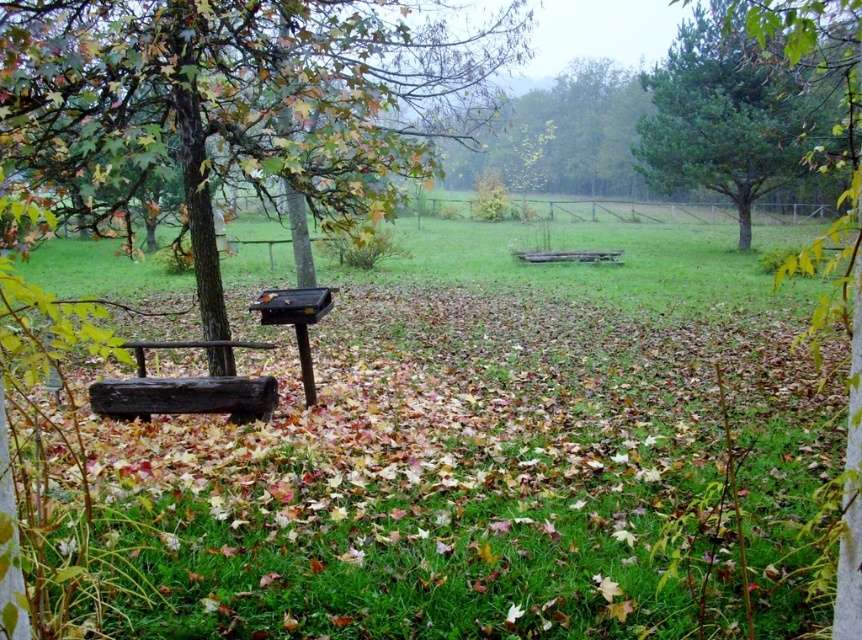
You are planning to take a photo of the brown textured tree trunk at left and the green pine tree at upper right. Which one should you focus on first if you want to capture both in the same frame without moving the camera?

The brown textured tree trunk at left is much taller than the green pine tree at upper right, so you should focus on the brown textured tree trunk at left first to ensure it fits entirely within the frame.